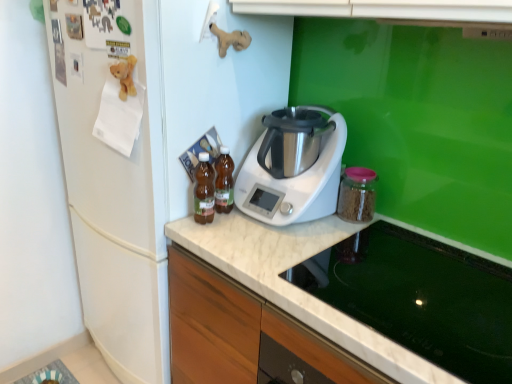
Find the location of a particular element. This screenshot has height=384, width=512. vacant space in between white plastic appliance at center, which is the third kitchen appliance in left-to-right order, and transparent glass jar at right, the 4th kitchen appliance in the left-to-right sequence is located at coordinates (335, 231).